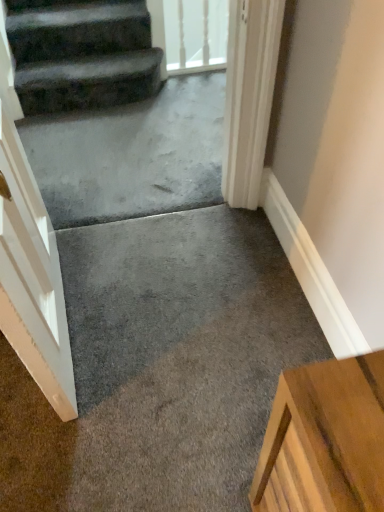
Question: Is gray concrete at center placed right next to transparent glass door at upper center?

Choices:
 (A) yes
 (B) no

Answer: (B)

Question: Does gray concrete at center come behind transparent glass door at upper center?

Choices:
 (A) yes
 (B) no

Answer: (B)

Question: Can you confirm if gray concrete at center is positioned to the right of transparent glass door at upper center?

Choices:
 (A) yes
 (B) no

Answer: (B)

Question: Considering the relative sizes of gray concrete at center and transparent glass door at upper center in the image provided, is gray concrete at center thinner than transparent glass door at upper center?

Choices:
 (A) no
 (B) yes

Answer: (A)

Question: Is gray concrete at center surrounding transparent glass door at upper center?

Choices:
 (A) yes
 (B) no

Answer: (B)

Question: From the image's perspective, relative to gray concrete at center, is transparent glass door at upper center above or below?

Choices:
 (A) below
 (B) above

Answer: (B)

Question: Considering the positions of transparent glass door at upper center and gray concrete at center in the image, is transparent glass door at upper center taller or shorter than gray concrete at center?

Choices:
 (A) short
 (B) tall

Answer: (B)

Question: Is transparent glass door at upper center bigger or smaller than gray concrete at center?

Choices:
 (A) small
 (B) big

Answer: (A)

Question: Is transparent glass door at upper center in front of or behind gray concrete at center in the image?

Choices:
 (A) front
 (B) behind

Answer: (B)

Question: From the image's perspective, is dark gray carpeted stairs at upper left positioned above or below transparent glass door at upper center?

Choices:
 (A) above
 (B) below

Answer: (B)

Question: Considering the positions of dark gray carpeted stairs at upper left and transparent glass door at upper center in the image, is dark gray carpeted stairs at upper left taller or shorter than transparent glass door at upper center?

Choices:
 (A) tall
 (B) short

Answer: (B)

Question: From a real-world perspective, is dark gray carpeted stairs at upper left physically located above or below transparent glass door at upper center?

Choices:
 (A) below
 (B) above

Answer: (A)

Question: Considering the relative positions of dark gray carpeted stairs at upper left and transparent glass door at upper center in the image provided, is dark gray carpeted stairs at upper left to the left or to the right of transparent glass door at upper center?

Choices:
 (A) left
 (B) right

Answer: (A)

Question: From a real-world perspective, is dark gray carpeted stairs at upper left above or below gray concrete at center?

Choices:
 (A) below
 (B) above

Answer: (B)

Question: Considering their positions, is dark gray carpeted stairs at upper left located in front of or behind gray concrete at center?

Choices:
 (A) behind
 (B) front

Answer: (A)